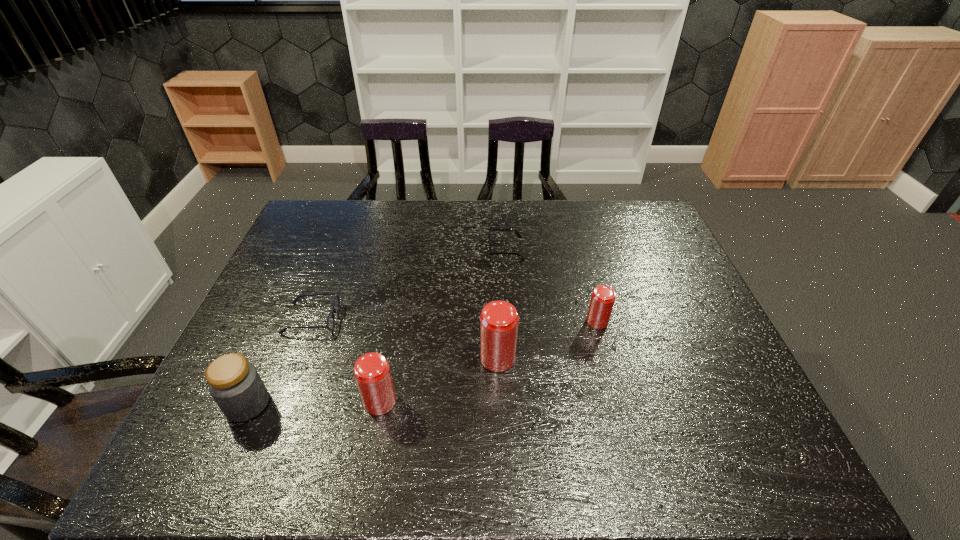
Find the location of a particular element. the leftmost beer can is located at coordinates (372, 373).

The image size is (960, 540). Identify the location of the nearest beer can. (372, 373).

The image size is (960, 540). I want to click on the tallest beer can, so click(499, 320).

This screenshot has height=540, width=960. Identify the location of the tallest object. (499, 320).

Locate an element on the screen. the rightmost beer can is located at coordinates (603, 297).

The width and height of the screenshot is (960, 540). In order to click on the shortest beer can in this screenshot , I will do `click(603, 297)`.

This screenshot has height=540, width=960. I want to click on the farthest object, so click(x=490, y=229).

Where is `spectacles`? spectacles is located at coordinates (330, 324).

Where is `jar`? jar is located at coordinates (234, 383).

I want to click on vacant position located 0.390m on the right of the fourth object from right to left, so click(x=565, y=402).